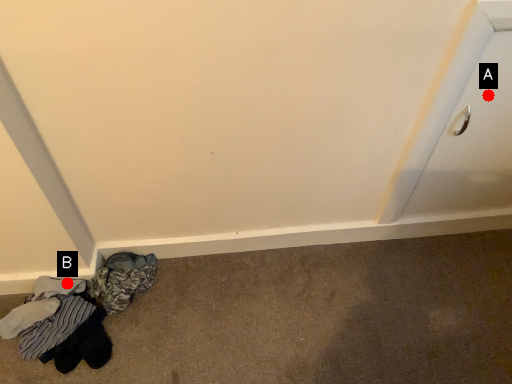
Question: Two points are circled on the image, labeled by A and B beside each circle. Which point is further to the camera?

Choices:
 (A) A is further
 (B) B is further

Answer: (B)